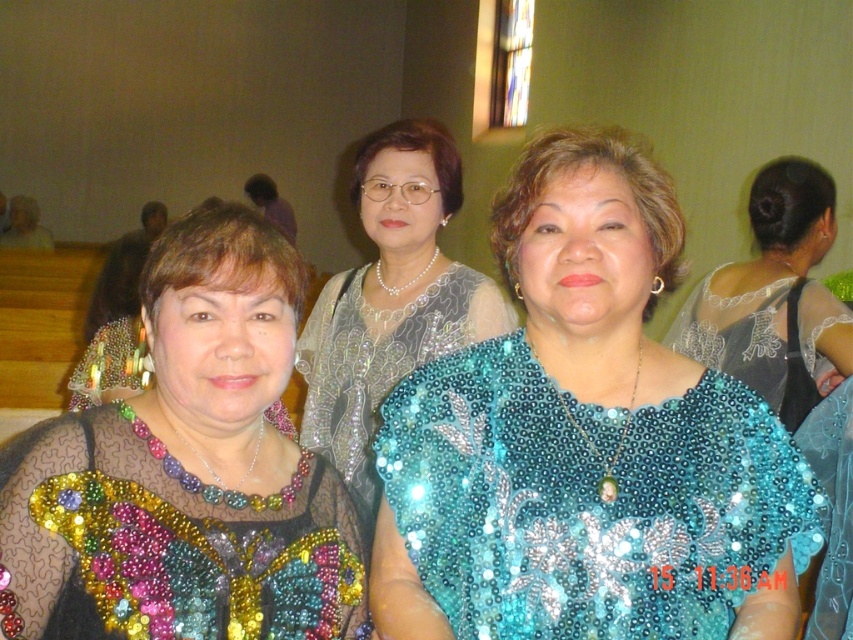
Question: Does multicolored sequined blouse at center appear on the left side of beaded fabric dress at center?

Choices:
 (A) no
 (B) yes

Answer: (B)

Question: Which point is closer to the camera taking this photo?

Choices:
 (A) (125, 566)
 (B) (396, 288)
 (C) (223, 588)

Answer: (A)

Question: Which point is closer to the camera?

Choices:
 (A) (500, 294)
 (B) (294, 513)

Answer: (B)

Question: Which of these objects is positioned farthest from the beaded fabric dress at center?

Choices:
 (A) multicolored sequined blouse at center
 (B) teal sequined blouse at center
 (C) pearl necklace at center
 (D) teal sequined dress at center

Answer: (D)

Question: Can you confirm if teal sequined blouse at center is positioned to the right of multicolored sequined blouse at center?

Choices:
 (A) no
 (B) yes

Answer: (B)

Question: Observing the image, what is the correct spatial positioning of teal sequined blouse at center in reference to multicolored sequined blouse at center?

Choices:
 (A) left
 (B) right

Answer: (B)